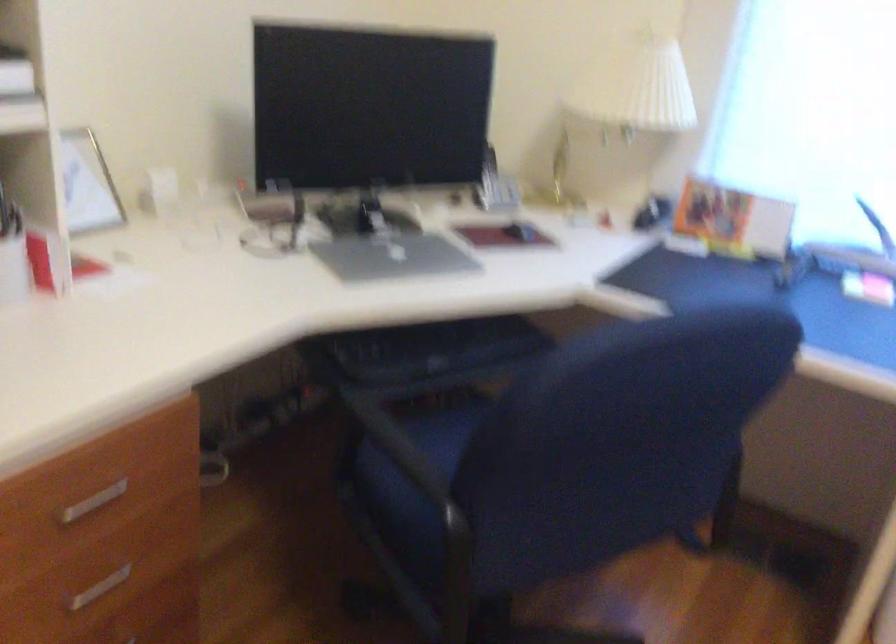
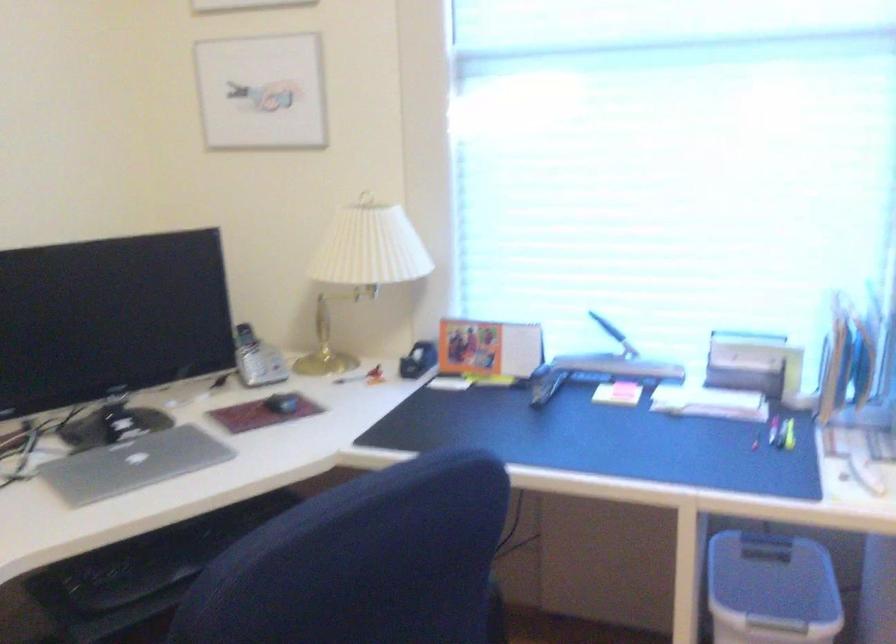
Question: Based on the continuous images, in which direction is the camera rotating? Reply with the corresponding letter.

Choices:
 (A) Left
 (B) Right
 (C) Up
 (D) Down

Answer: (B)